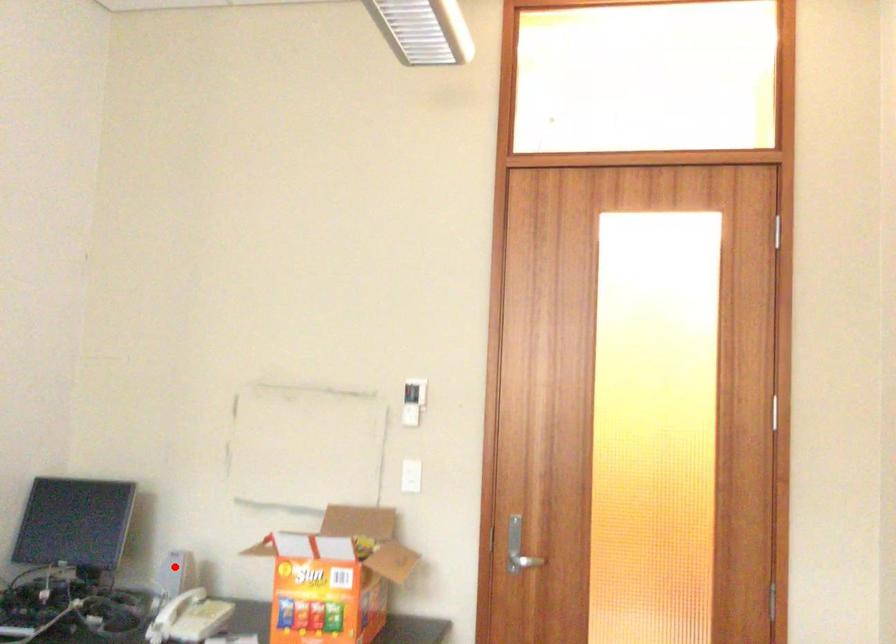
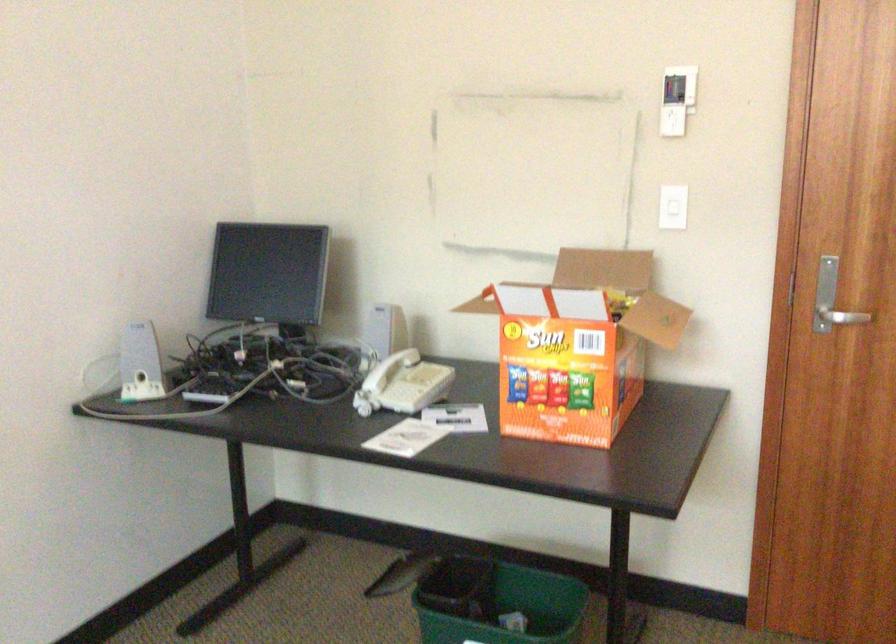
In the second image, find the point that corresponds to the highlighted location in the first image.

(384, 328)